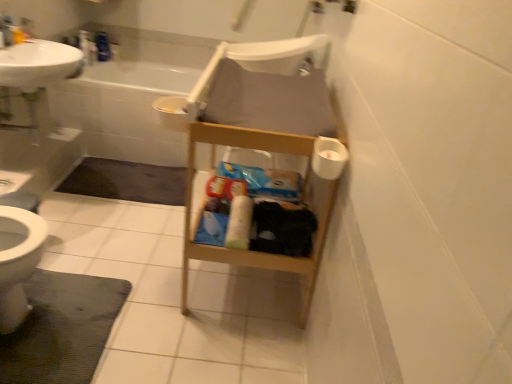
Image resolution: width=512 pixels, height=384 pixels. Identify the location of vacant area situated below dark gray textured bath mat at lower left, the 2th bath mat in the back-to-front sequence (from a real-world perspective). (82, 315).